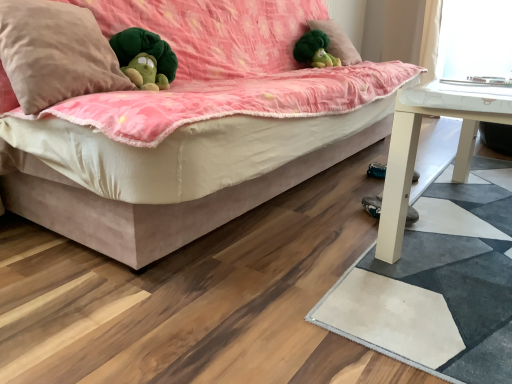
At what (x,y) coordinates should I click in order to perform the action: click on vacant space that is in between suede-like beige studio couch at center and white matte mat at lower right. Please return your answer as a coordinate pair (x, y). Looking at the image, I should click on (365, 233).